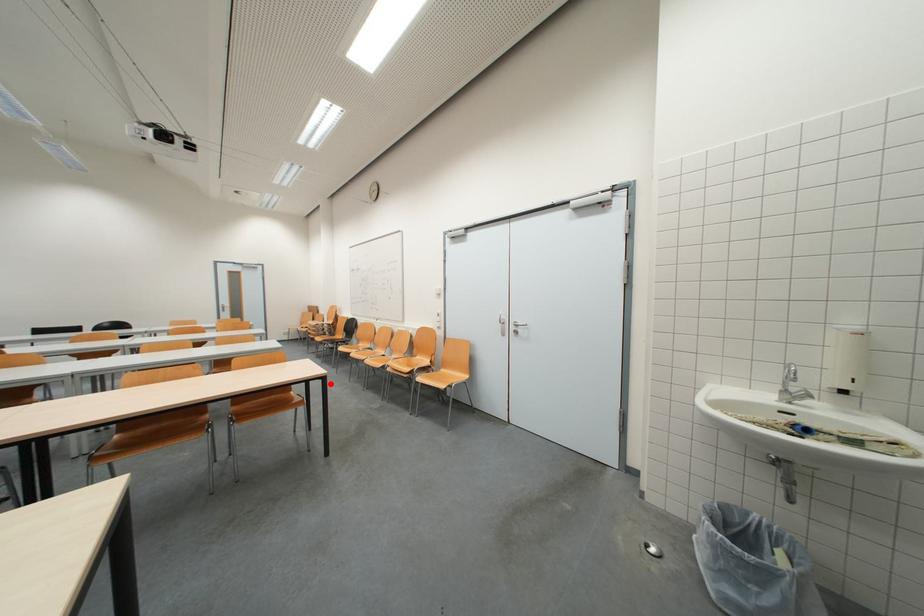
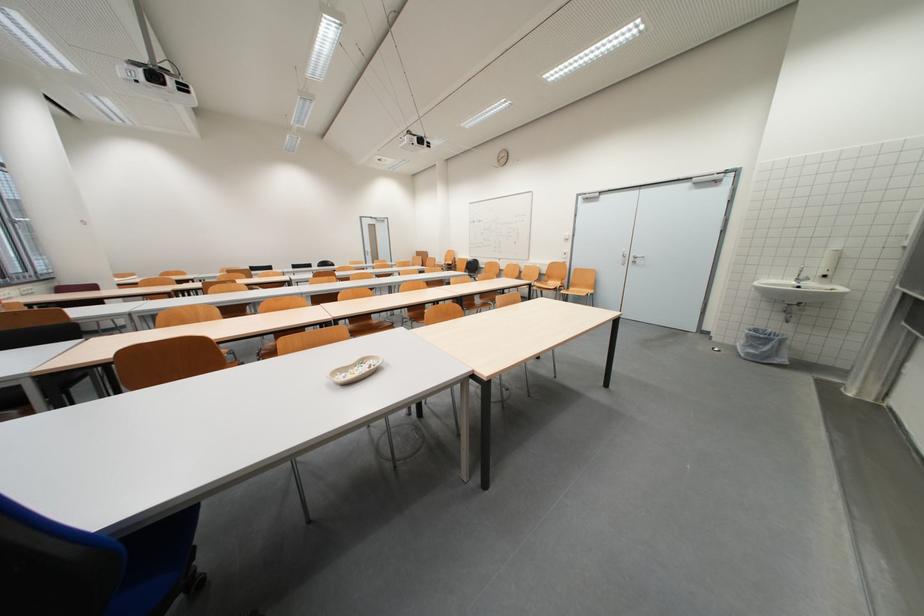
Question: I am providing you with two images of the same scene from different viewpoints. Image1 has a red point marked. In image2, the corresponding 3D location appears at what relative position? Reply with the corresponding letter.

Choices:
 (A) Closer
 (B) Farther

Answer: (B)